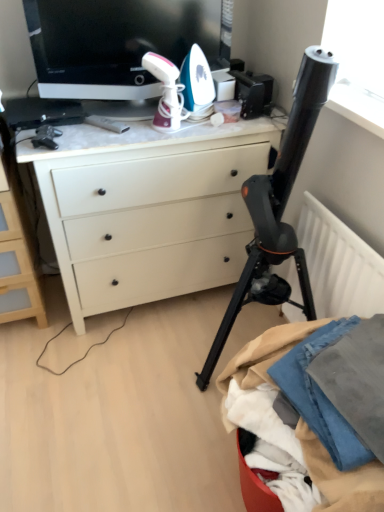
Where is `vacant area that is in front of white matte chest of drawers at left`? Image resolution: width=384 pixels, height=512 pixels. vacant area that is in front of white matte chest of drawers at left is located at coordinates (36, 359).